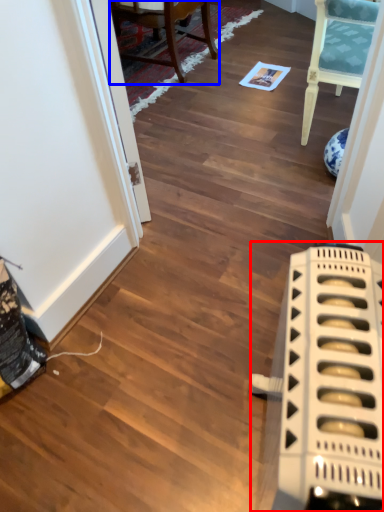
Question: Among these objects, which one is farthest to the camera, appliance (highlighted by a red box) or chair (highlighted by a blue box)?

Choices:
 (A) appliance
 (B) chair

Answer: (B)